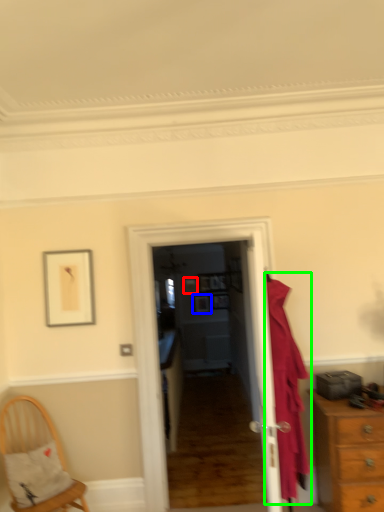
Question: Which is nearer to the picture frame (highlighted by a red box)? picture frame (highlighted by a blue box) or clothing (highlighted by a green box).

Choices:
 (A) picture frame
 (B) clothing

Answer: (A)